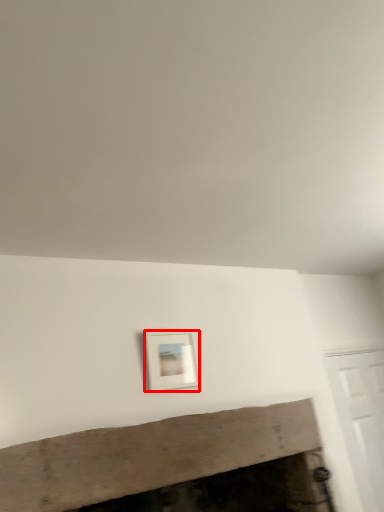
Question: Considering the relative positions of picture frame (annotated by the red box) and fireplace in the image provided, where is picture frame (annotated by the red box) located with respect to the staircase?

Choices:
 (A) right
 (B) left

Answer: (A)